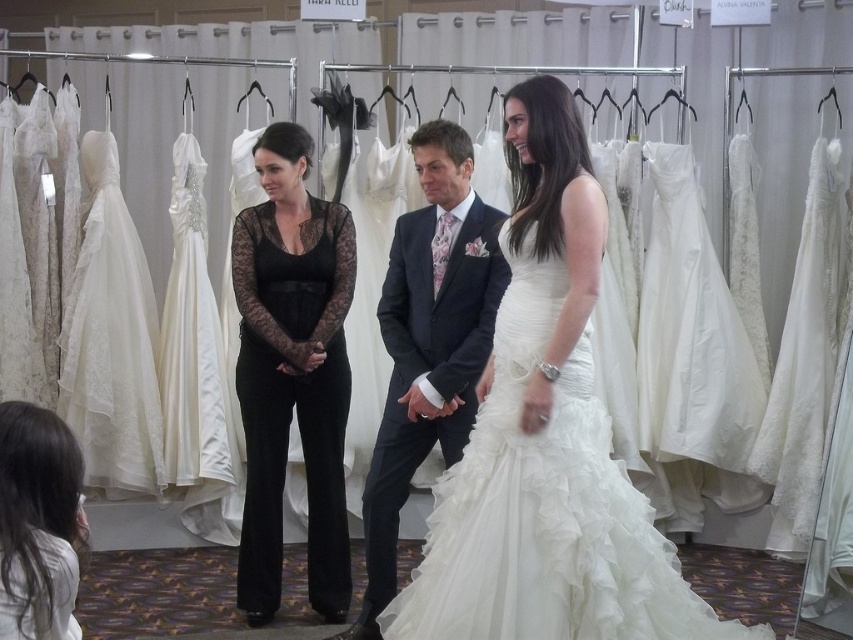
Does black lace jumpsuit at center have a smaller size compared to ivory lace wedding dress at left?

Actually, black lace jumpsuit at center might be larger than ivory lace wedding dress at left.

Image resolution: width=853 pixels, height=640 pixels. I want to click on black lace jumpsuit at center, so click(292, 372).

This screenshot has width=853, height=640. I want to click on black lace jumpsuit at center, so click(x=292, y=372).

You are a GUI agent. You are given a task and a screenshot of the screen. Output one action in this format:
    pyautogui.click(x=<x>, y=<y>)
    Task: Click on the black lace jumpsuit at center
    The image size is (853, 640).
    Given the screenshot: What is the action you would take?
    pyautogui.click(x=292, y=372)

Is the position of black lace jumpsuit at center less distant than that of dark gray suit at center?

That is False.

Identify the location of black lace jumpsuit at center. The width and height of the screenshot is (853, 640). (292, 372).

Identify the location of black lace jumpsuit at center. Image resolution: width=853 pixels, height=640 pixels. (292, 372).

Can you confirm if dark gray suit at center is wider than smooth white blouse at lower left?

Yes.

Which is below, dark gray suit at center or smooth white blouse at lower left?

smooth white blouse at lower left is lower down.

You are a GUI agent. You are given a task and a screenshot of the screen. Output one action in this format:
    pyautogui.click(x=<x>, y=<y>)
    Task: Click on the dark gray suit at center
    
    Given the screenshot: What is the action you would take?
    pyautogui.click(x=428, y=342)